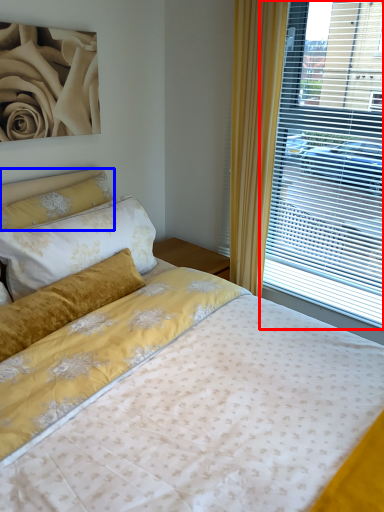
Question: Which point is closer to the camera, window (highlighted by a red box) or pillow (highlighted by a blue box)?

Choices:
 (A) window
 (B) pillow

Answer: (A)